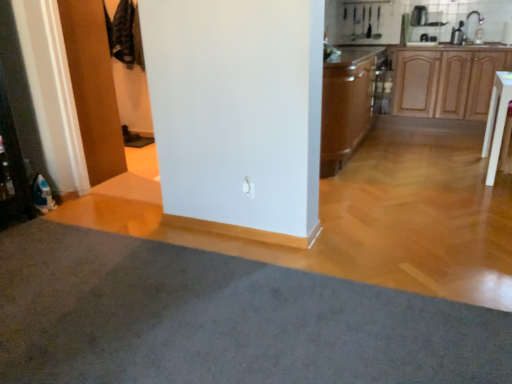
Question: Considering the relative sizes of wooden door at left and brown wood cabinet at center, positioned as the first cabinetry in left-to-right order, in the image provided, is wooden door at left bigger than brown wood cabinet at center, positioned as the first cabinetry in left-to-right order,?

Choices:
 (A) yes
 (B) no

Answer: (B)

Question: Considering the relative sizes of wooden door at left and brown wood cabinet at center, positioned as the 2th cabinetry in right-to-left order, in the image provided, is wooden door at left taller than brown wood cabinet at center, positioned as the 2th cabinetry in right-to-left order,?

Choices:
 (A) no
 (B) yes

Answer: (B)

Question: Is wooden door at left in contact with brown wood cabinet at center, positioned as the first cabinetry in left-to-right order?

Choices:
 (A) yes
 (B) no

Answer: (B)

Question: Is wooden door at left at the right side of brown wood cabinet at center, positioned as the 2th cabinetry in right-to-left order?

Choices:
 (A) no
 (B) yes

Answer: (A)

Question: Is the position of wooden door at left less distant than that of brown wood cabinet at center, positioned as the 2th cabinetry in right-to-left order?

Choices:
 (A) no
 (B) yes

Answer: (B)

Question: Can you confirm if wooden door at left is thinner than brown wood cabinet at center, positioned as the 2th cabinetry in right-to-left order?

Choices:
 (A) no
 (B) yes

Answer: (B)

Question: Is wooden cabinet at right, the 1th cabinetry in the right-to-left sequence, closer to the viewer compared to wooden door at left?

Choices:
 (A) yes
 (B) no

Answer: (B)

Question: From the image's perspective, is wooden cabinet at right, the 1th cabinetry in the right-to-left sequence, located beneath wooden door at left?

Choices:
 (A) no
 (B) yes

Answer: (A)

Question: From the image's perspective, would you say wooden cabinet at right, the 1th cabinetry in the right-to-left sequence, is positioned over wooden door at left?

Choices:
 (A) yes
 (B) no

Answer: (A)

Question: Is wooden cabinet at right, the 1th cabinetry in the right-to-left sequence, shorter than wooden door at left?

Choices:
 (A) no
 (B) yes

Answer: (B)

Question: Is wooden cabinet at right, which is the second cabinetry in left-to-right order, positioned behind wooden door at left?

Choices:
 (A) no
 (B) yes

Answer: (B)

Question: Can you confirm if wooden cabinet at right, the 1th cabinetry in the right-to-left sequence, is positioned to the left of wooden door at left?

Choices:
 (A) no
 (B) yes

Answer: (A)

Question: Is wooden cabinet at right, which is the second cabinetry in left-to-right order, not within wooden at upper right?

Choices:
 (A) yes
 (B) no

Answer: (A)